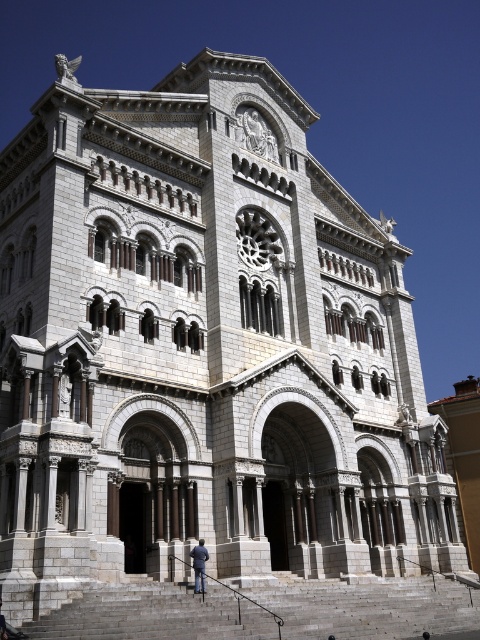
Question: Which of the following is the farthest from the observer?

Choices:
 (A) (240, 620)
 (B) (197, 582)

Answer: (B)

Question: Considering the relative positions of gray stone stairs at lower center and blue jeans at lower center in the image provided, where is gray stone stairs at lower center located with respect to blue jeans at lower center?

Choices:
 (A) right
 (B) left

Answer: (A)

Question: Can you confirm if gray stone stairs at lower center is bigger than blue jeans at lower center?

Choices:
 (A) yes
 (B) no

Answer: (A)

Question: Which of the following is the farthest from the observer?

Choices:
 (A) (115, 620)
 (B) (199, 554)

Answer: (B)

Question: Among these objects, which one is farthest from the camera?

Choices:
 (A) blue jeans at lower center
 (B) gray stone stairs at lower center

Answer: (A)

Question: Considering the relative positions of gray stone stairs at lower center and blue jeans at lower center in the image provided, where is gray stone stairs at lower center located with respect to blue jeans at lower center?

Choices:
 (A) above
 (B) below

Answer: (B)